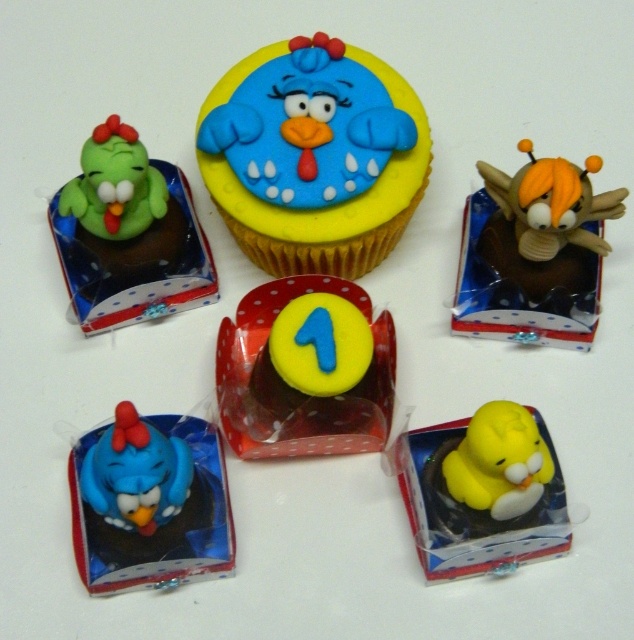
You are a photographer standing at a distance of 1.2 meters from the central cupcake. You want to take a closeup photo of the central cupcake. Is the point at coordinates point (318, 221) within your reach to focus on the central cupcake?

The distance of point (318, 221) from camera is 1.27 meters, which is slightly further than your current position of 1.2 meters. Therefore, you need to move 0.07 meters closer to focus on the central cupcake.

You are a baker who wants to display the orange fuzzy bee at upper right and the green matte bird at upper left on a shelf. Which one should you place higher up so they appear at the same visual height from the customer standing in front?

The orange fuzzy bee at upper right is taller than the green matte bird at upper left, so you should place the green matte bird at upper left higher up on the shelf to balance their visual height.

You are a baker preparing for a themed party and need to arrange the blue fondant cupcake at center and the yellow rubber duck at lower right on a shelf. If the shelf has limited space, which item should you place first to ensure both fit?

The blue fondant cupcake at center has a larger width than the yellow rubber duck at lower right, so you should place the blue fondant cupcake at center first to ensure both items fit on the shelf.